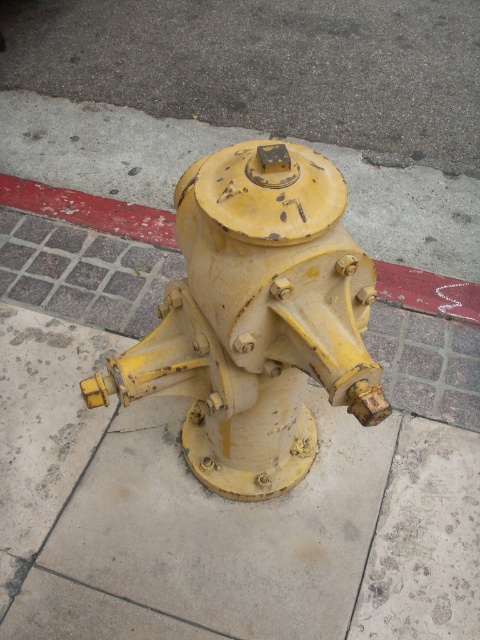
Question: Can you confirm if yellow matte hydrant at center is positioned above red painted concrete curb at lower center?

Choices:
 (A) yes
 (B) no

Answer: (B)

Question: Which of the following is the farthest from the observer?

Choices:
 (A) red painted concrete curb at lower center
 (B) yellow matte hydrant at center

Answer: (A)

Question: Does yellow matte hydrant at center have a larger size compared to red painted concrete curb at lower center?

Choices:
 (A) no
 (B) yes

Answer: (B)

Question: Can you confirm if yellow matte hydrant at center is thinner than red painted concrete curb at lower center?

Choices:
 (A) yes
 (B) no

Answer: (A)